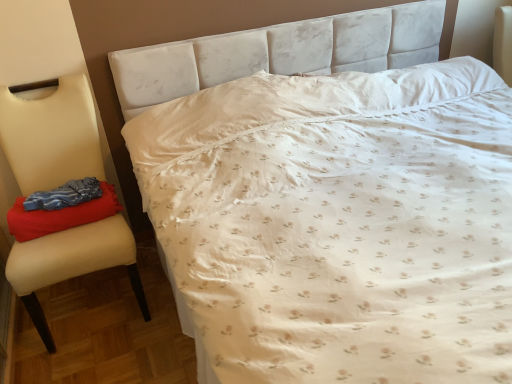
Identify the location of empty space that is ontop of velvety red blanket at left (from a real-world perspective). (57, 198).